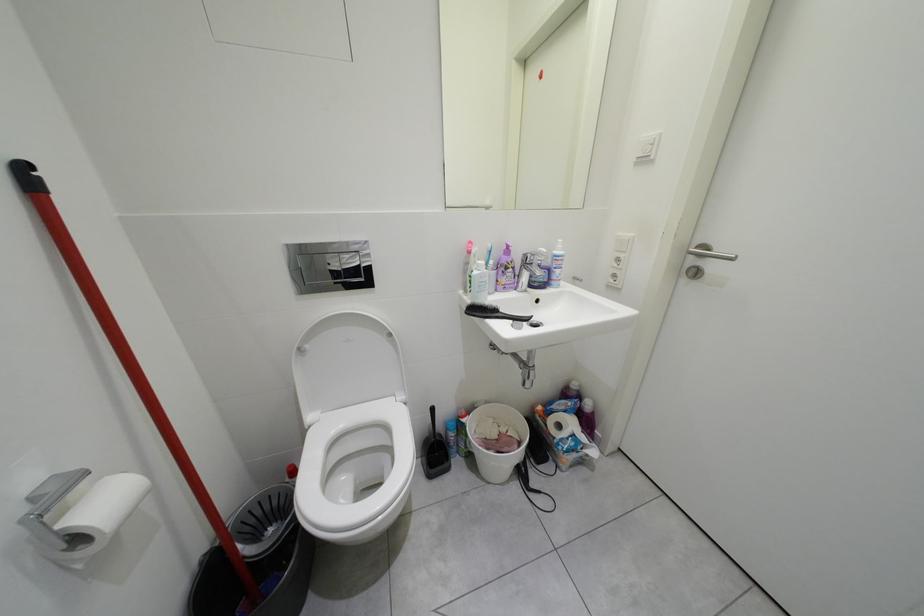
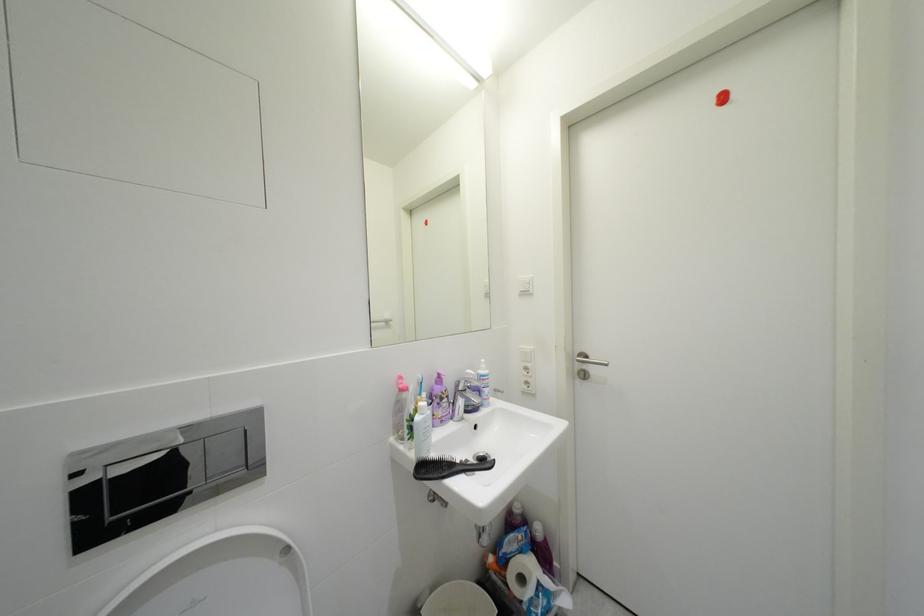
Based on the photo, the images are taken continuously from a first-person perspective. In which direction is your viewpoint rotating?

The camera's rotation is toward right-up.